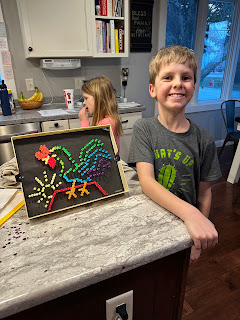
Find the location of `dish washer`. dish washer is located at coordinates coord(11,129).